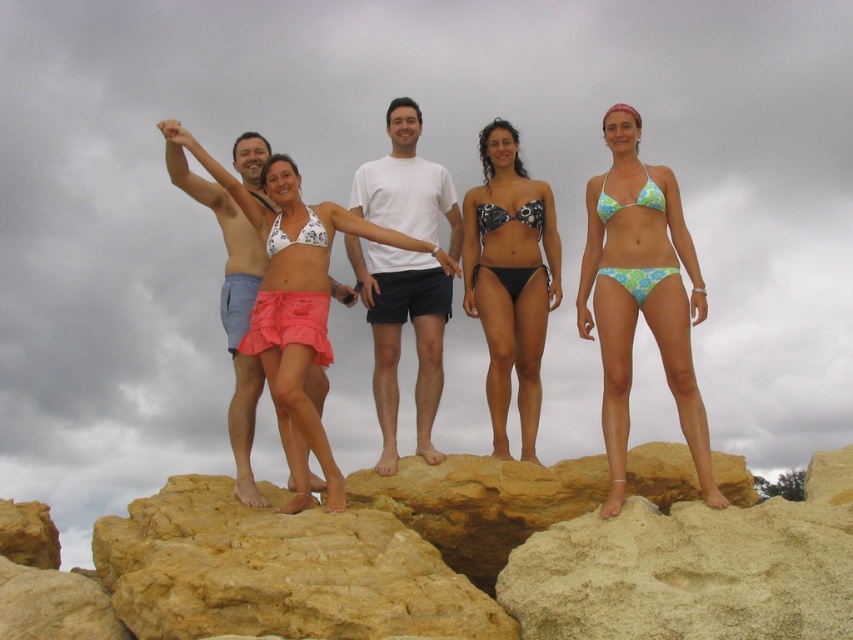
Find the location of a particular element. yellow sandstone rock at center is located at coordinates (453, 557).

Who is positioned more to the right, yellow sandstone rock at center or light blue denim shorts at left?

From the viewer's perspective, yellow sandstone rock at center appears more on the right side.

Locate an element on the screen. This screenshot has height=640, width=853. yellow sandstone rock at center is located at coordinates (453, 557).

The width and height of the screenshot is (853, 640). What do you see at coordinates (453, 557) in the screenshot? I see `yellow sandstone rock at center` at bounding box center [453, 557].

Find the location of a particular element. yellow sandstone rock at center is located at coordinates (453, 557).

Can you confirm if white matte t-shirt at center is positioned to the right of green floral bikini at right?

In fact, white matte t-shirt at center is to the left of green floral bikini at right.

Is white matte t-shirt at center closer to camera compared to green floral bikini at right?

No, it is not.

Find the location of a particular element. white matte t-shirt at center is located at coordinates [399, 337].

What are the coordinates of `white matte t-shirt at center` in the screenshot? It's located at (399, 337).